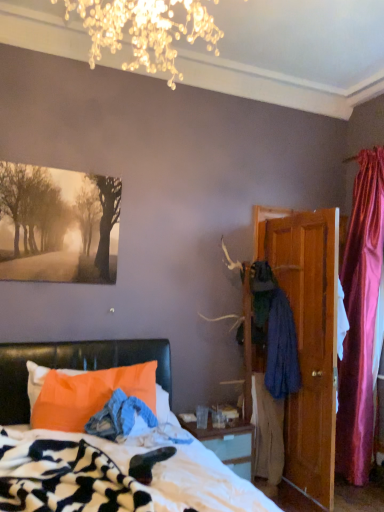
I want to click on blank space above matte black painting at upper left (from a real-world perspective), so point(70,165).